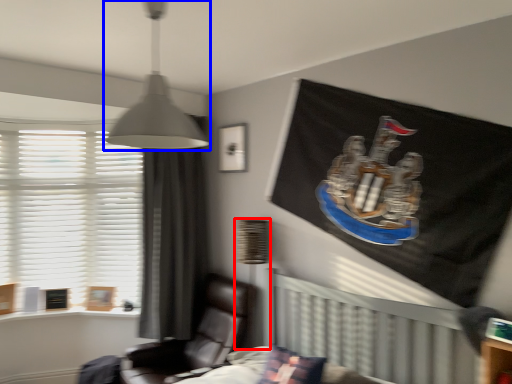
Question: Which of the following is the farthest to the observer, table lamp (highlighted by a red box) or lamp (highlighted by a blue box)?

Choices:
 (A) table lamp
 (B) lamp

Answer: (A)